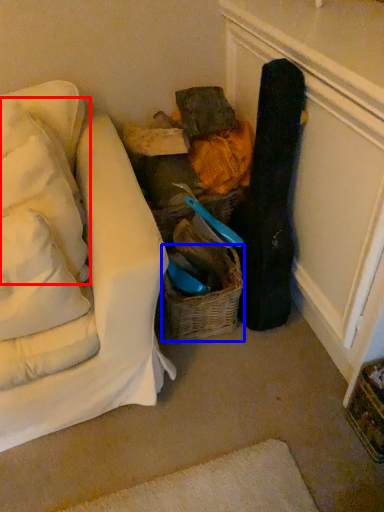
Question: Which point is closer to the camera, pillow (highlighted by a red box) or basket (highlighted by a blue box)?

Choices:
 (A) pillow
 (B) basket

Answer: (A)